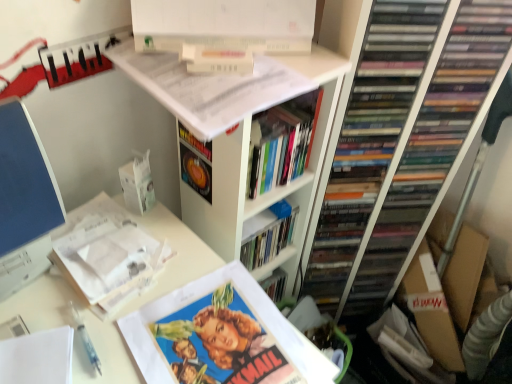
This screenshot has width=512, height=384. Find the location of `free space above vintage paper movie poster at center, which is the first book in bottom-to-top order (from a real-world perspective)`. free space above vintage paper movie poster at center, which is the first book in bottom-to-top order (from a real-world perspective) is located at coordinates (223, 339).